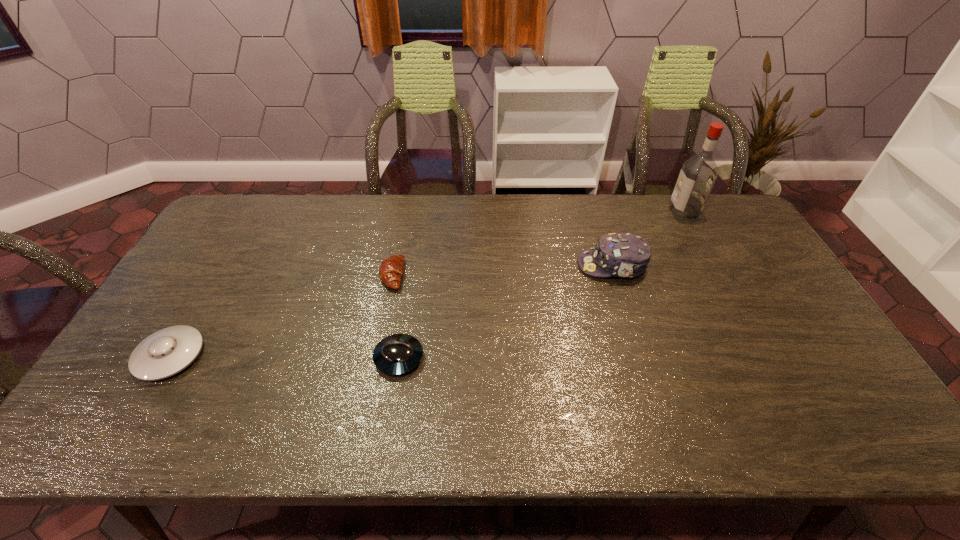
Image resolution: width=960 pixels, height=540 pixels. Identify the location of the tallest object. (698, 174).

Identify the location of the rightmost object. (698, 174).

Find the location of a particular element. Image resolution: width=960 pixels, height=540 pixels. headwear is located at coordinates (627, 255).

Find the location of `the fourth shortest object`. the fourth shortest object is located at coordinates (627, 255).

Locate an element on the screen. the left saucer is located at coordinates pyautogui.click(x=166, y=352).

Identify the location of the leftmost object. Image resolution: width=960 pixels, height=540 pixels. (166, 352).

Find the location of a particular element. The image size is (960, 540). crescent roll is located at coordinates (391, 269).

You are a GUI agent. You are given a task and a screenshot of the screen. Output one action in this format:
    pyautogui.click(x=<x>, y=<y>)
    Task: Click on the right saucer
    This screenshot has height=540, width=960.
    Given the screenshot: What is the action you would take?
    pyautogui.click(x=397, y=354)

At what (x,y) coordinates should I click in order to perform the action: click on blank space located 0.130m on the front-facing side of the farthest object. Please return your answer as a coordinate pair (x, y). Looking at the image, I should click on coord(635,211).

You are a GUI agent. You are given a task and a screenshot of the screen. Output one action in this format:
    pyautogui.click(x=<x>, y=<y>)
    Task: Click on the free point located 0.100m on the front-facing side of the farthest object
    
    Given the screenshot: What is the action you would take?
    pyautogui.click(x=642, y=211)